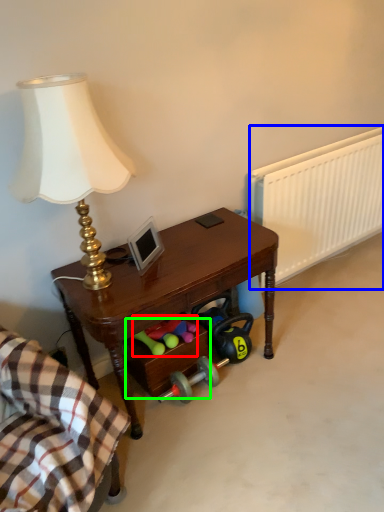
Question: Which object is positioned closest to stuff (highlighted by a red box)? Select from radiator (highlighted by a blue box) and drawer (highlighted by a green box).

Choices:
 (A) radiator
 (B) drawer

Answer: (B)